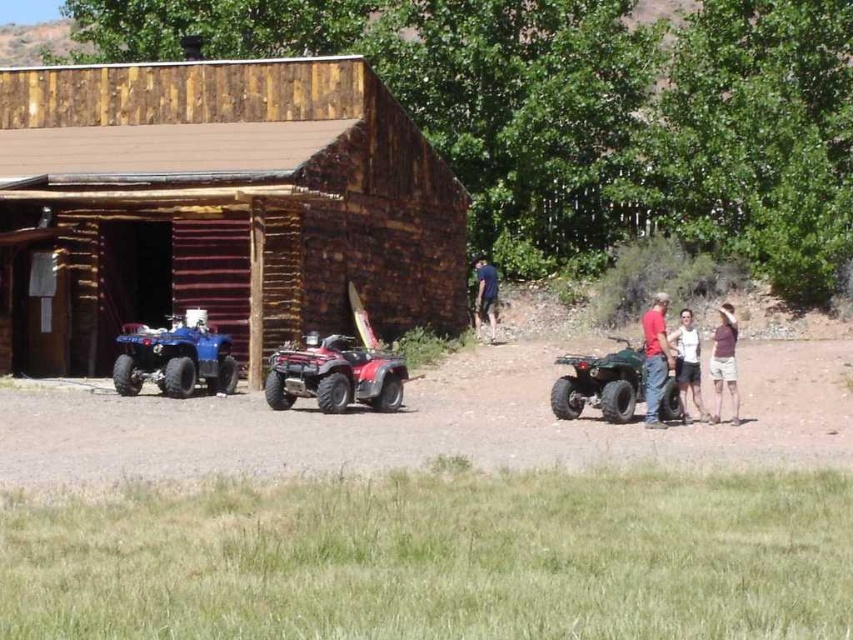
You are standing at the entrance of the wooden cabin and want to reach the blue matte quad bike at left. According to the coordinates provided, in which direction should you move relative to the cabin to find it?

The blue matte quad bike at left is located at point coordinates, so you should move towards the left side of the cabin to find it.

You are planning to park your new ATV next to the blue matte quad bike at left and the green matte quad bike at right. Based on their sizes, which ATV requires more space between them to avoid touching?

The blue matte quad bike at left requires more space because its width is larger than the green matte quad bike at right, so to avoid touching, you need to leave more space between them compared to the green one.